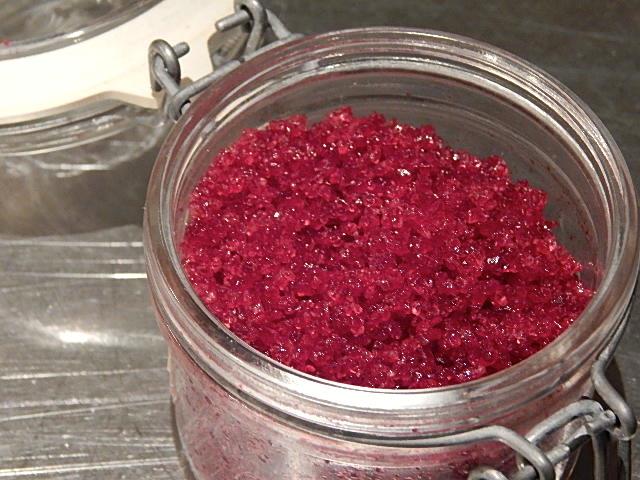
Find the location of a particular element. The height and width of the screenshot is (480, 640). jar lid is located at coordinates (38, 16).